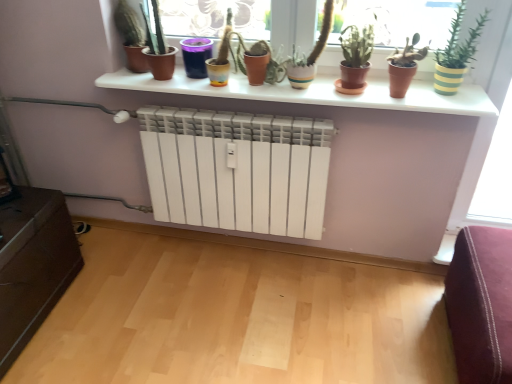
Question: Considering the relative sizes of terracotta clay pot at center, positioned as the fourth houseplant in left-to-right order, and yellow-green striped pot at upper right, the 5th houseplant positioned from the left, in the image provided, is terracotta clay pot at center, positioned as the fourth houseplant in left-to-right order, taller than yellow-green striped pot at upper right, the 5th houseplant positioned from the left,?

Choices:
 (A) yes
 (B) no

Answer: (B)

Question: From a real-world perspective, is terracotta clay pot at center, positioned as the 2th houseplant in right-to-left order, beneath yellow-green striped pot at upper right, which appears as the 1th houseplant when viewed from the right?

Choices:
 (A) no
 (B) yes

Answer: (B)

Question: Considering the relative sizes of terracotta clay pot at center, positioned as the fourth houseplant in left-to-right order, and yellow-green striped pot at upper right, the 5th houseplant positioned from the left, in the image provided, is terracotta clay pot at center, positioned as the fourth houseplant in left-to-right order, smaller than yellow-green striped pot at upper right, the 5th houseplant positioned from the left,?

Choices:
 (A) no
 (B) yes

Answer: (B)

Question: From the image's perspective, would you say terracotta clay pot at center, positioned as the fourth houseplant in left-to-right order, is positioned over yellow-green striped pot at upper right, the 5th houseplant positioned from the left?

Choices:
 (A) yes
 (B) no

Answer: (B)

Question: Can you confirm if terracotta clay pot at center, positioned as the 2th houseplant in right-to-left order, is positioned to the left of yellow-green striped pot at upper right, the 5th houseplant positioned from the left?

Choices:
 (A) yes
 (B) no

Answer: (A)

Question: From a real-world perspective, relative to white matte radiator at center, is matte terracotta pot at center, the 2th vase from the left, vertically above or below?

Choices:
 (A) below
 (B) above

Answer: (B)

Question: Would you say matte terracotta pot at center, the 2th vase from the left, is inside or outside white matte radiator at center?

Choices:
 (A) outside
 (B) inside

Answer: (A)

Question: Considering the positions of matte terracotta pot at center, the 2th vase from the left, and white matte radiator at center in the image, is matte terracotta pot at center, the 2th vase from the left, taller or shorter than white matte radiator at center?

Choices:
 (A) short
 (B) tall

Answer: (B)

Question: Considering the positions of matte terracotta pot at center, which is the first vase from right to left, and white matte radiator at center in the image, is matte terracotta pot at center, which is the first vase from right to left, wider or thinner than white matte radiator at center?

Choices:
 (A) wide
 (B) thin

Answer: (B)

Question: In terms of height, does white matte shelf at upper center look taller or shorter compared to green matte plant at center, the third houseplant from the left?

Choices:
 (A) tall
 (B) short

Answer: (B)

Question: In the image, is white matte shelf at upper center on the left side or the right side of green matte plant at center, the third houseplant from the left?

Choices:
 (A) left
 (B) right

Answer: (A)

Question: From a real-world perspective, relative to green matte plant at center, the third houseplant from the left, is white matte shelf at upper center vertically above or below?

Choices:
 (A) below
 (B) above

Answer: (A)

Question: Relative to green matte plant at center, placed as the third houseplant when sorted from right to left, is white matte shelf at upper center in front or behind?

Choices:
 (A) behind
 (B) front

Answer: (A)

Question: Considering the relative positions of matte black pot at upper left, which appears as the 1th houseplant when viewed from the left, and matte terracotta pot at center, the 2th vase from the left, in the image provided, is matte black pot at upper left, which appears as the 1th houseplant when viewed from the left, to the left or to the right of matte terracotta pot at center, the 2th vase from the left,?

Choices:
 (A) right
 (B) left

Answer: (B)

Question: From the image's perspective, relative to matte terracotta pot at center, the 2th vase from the left, is matte black pot at upper left, which appears as the 1th houseplant when viewed from the left, above or below?

Choices:
 (A) below
 (B) above

Answer: (B)